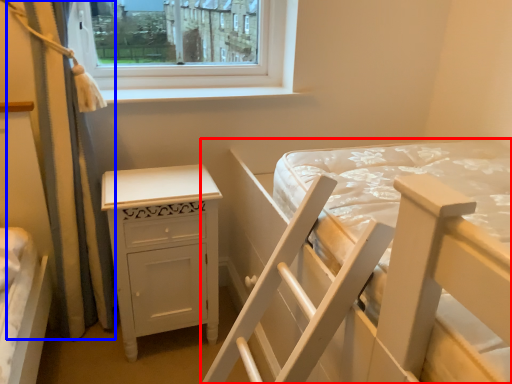
Question: Which of the following is the closest to the observer, bed (highlighted by a red box) or curtain (highlighted by a blue box)?

Choices:
 (A) bed
 (B) curtain

Answer: (A)